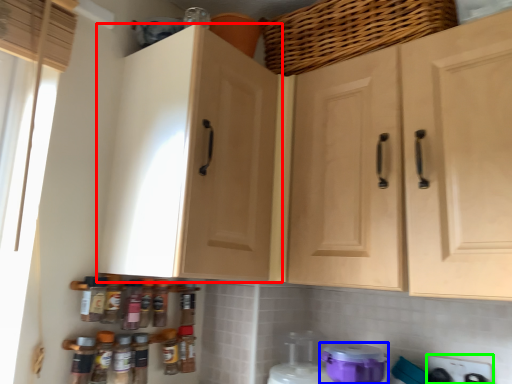
Question: Which object is the farthest from cabinetry (highlighted by a red box)? Choose among these: appliance (highlighted by a blue box) or appliance (highlighted by a green box).

Choices:
 (A) appliance
 (B) appliance

Answer: (B)